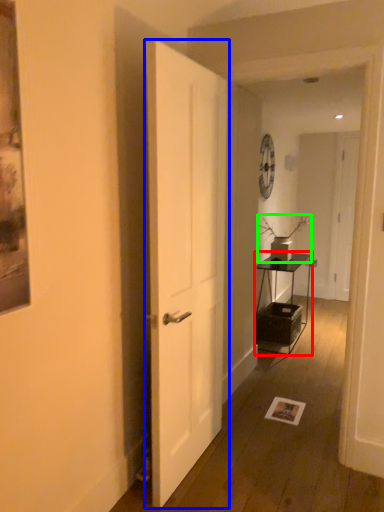
Question: Based on their relative distances, which object is farther from table (highlighted by a red box)? Choose from door (highlighted by a blue box) and houseplant (highlighted by a green box).

Choices:
 (A) door
 (B) houseplant

Answer: (A)